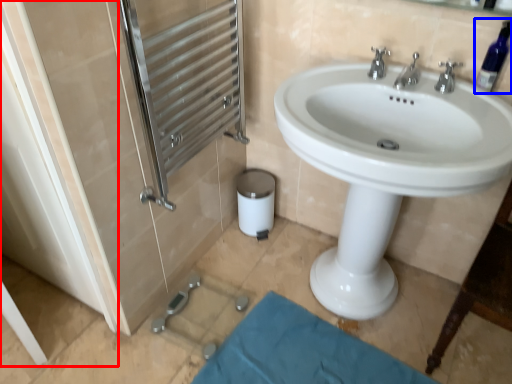
Question: Among these objects, which one is nearest to the camera, screen door (highlighted by a red box) or bottle (highlighted by a blue box)?

Choices:
 (A) screen door
 (B) bottle

Answer: (A)